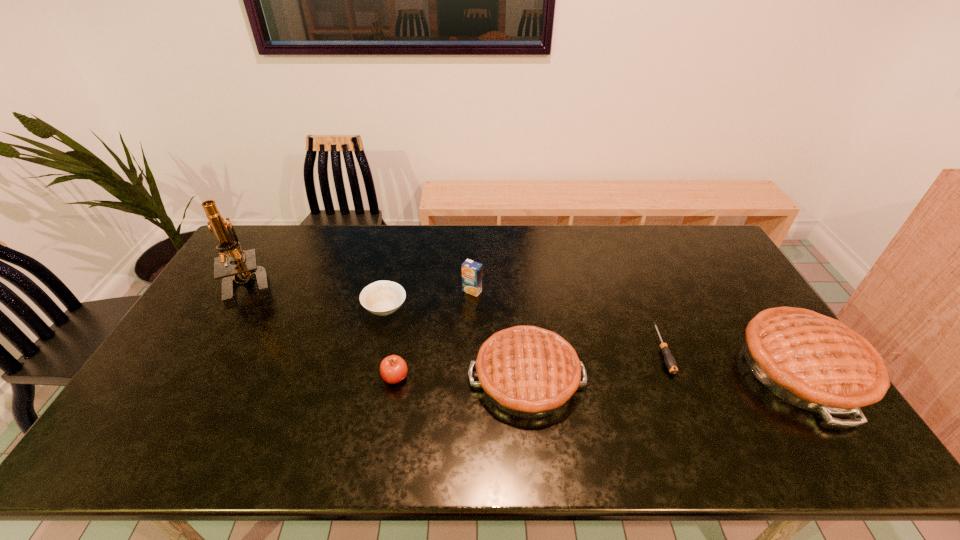
You are a GUI agent. You are given a task and a screenshot of the screen. Output one action in this format:
    pyautogui.click(x=<x>, y=<y>)
    Task: Click on the shorter pie
    
    Given the screenshot: What is the action you would take?
    pyautogui.click(x=527, y=371)

Image resolution: width=960 pixels, height=540 pixels. Find the location of `the rightmost object`. the rightmost object is located at coordinates (814, 362).

Where is `the second tallest object`? The image size is (960, 540). the second tallest object is located at coordinates (814, 362).

Locate an element on the screen. The image size is (960, 540). orange_juice is located at coordinates (471, 271).

Where is `screwdriver`? Image resolution: width=960 pixels, height=540 pixels. screwdriver is located at coordinates (670, 362).

Identify the location of the shortest object. The width and height of the screenshot is (960, 540). (670, 362).

You are a GUI agent. You are given a task and a screenshot of the screen. Output one action in this format:
    pyautogui.click(x=<x>, y=<y>)
    Task: Click on the leftmost object
    Image resolution: width=960 pixels, height=540 pixels.
    Given the screenshot: What is the action you would take?
    pyautogui.click(x=245, y=267)

This screenshot has height=540, width=960. Find the location of `microscope`. microscope is located at coordinates click(x=245, y=267).

This screenshot has height=540, width=960. What are the coordinates of `bowl` in the screenshot? It's located at (382, 298).

This screenshot has height=540, width=960. I want to click on the third shortest object, so click(393, 369).